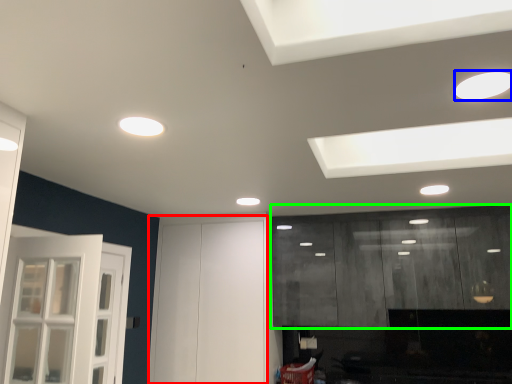
Question: Estimate the real-world distances between objects in this image. Which object is farther from door (highlighted by a red box), lighting (highlighted by a blue box) or cabinetry (highlighted by a green box)?

Choices:
 (A) lighting
 (B) cabinetry

Answer: (A)